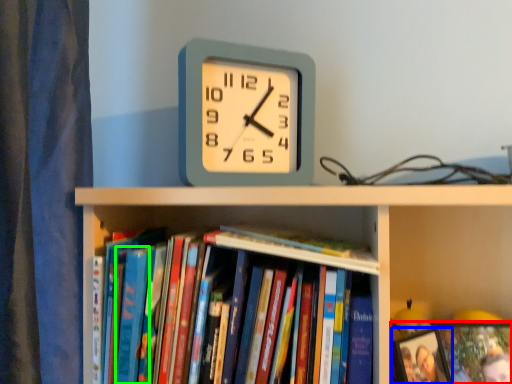
Question: Which object is positioned farthest from book (highlighted by a red box)? Select from picture frame (highlighted by a blue box) and paperback book (highlighted by a green box).

Choices:
 (A) picture frame
 (B) paperback book

Answer: (B)